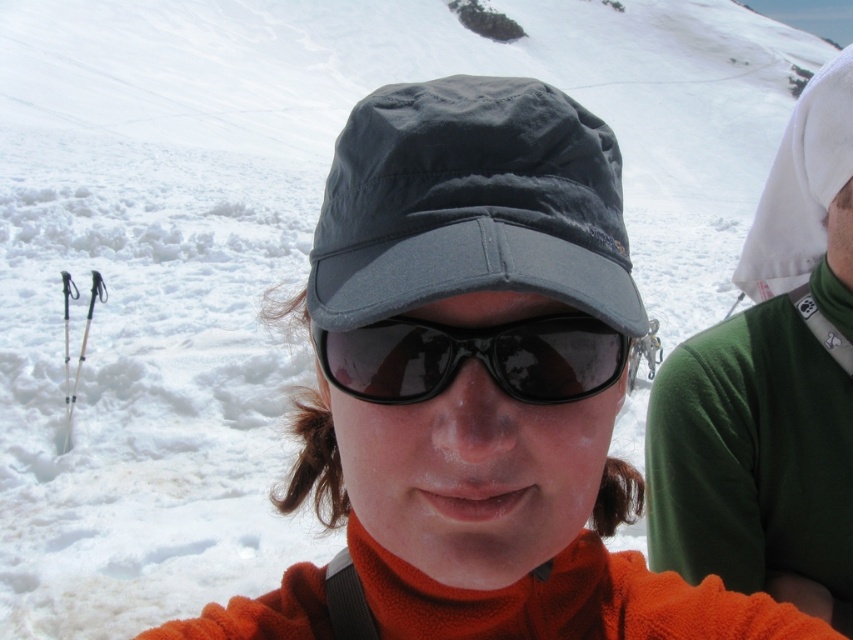
You are a photographer trying to capture the person in the snow. You notice the green fleece sweater at right and the black matte sunglasses at center. Which object is located to the right of the other?

The green fleece sweater at right is positioned on the right side of black matte sunglasses at center.

From the picture: You are packing for a winter trip and have both the green fleece sweater at right and the black matte sunglasses at center in your bag. Which item takes up more space in your bag?

The green fleece sweater at right is larger in size than the black matte sunglasses at center, so it takes up more space in the bag.

You are an outdoor enthusiast planning to take a photo of the green fleece sweater at right and the black matte sunglasses at center. If you want to ensure both items are fully visible in the frame, should you adjust your camera to a wider angle or a narrower angle?

The green fleece sweater at right might be wider than black matte sunglasses at center, so to ensure both items are fully visible in the frame, you should adjust your camera to a wider angle.